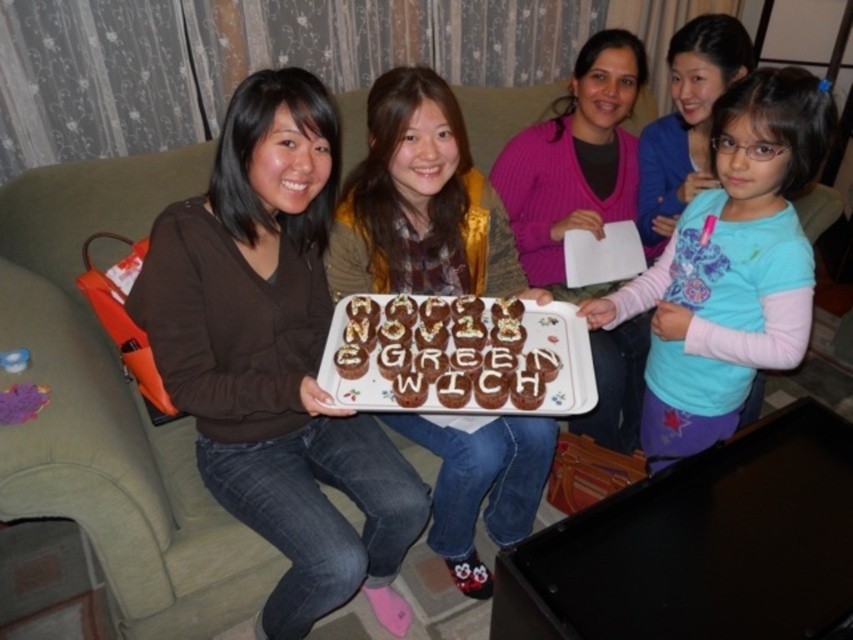
Question: Considering the relative positions of pink ribbed sweater at center and chocolatesmoothcake at center in the image provided, where is pink ribbed sweater at center located with respect to chocolatesmoothcake at center?

Choices:
 (A) above
 (B) below

Answer: (A)

Question: From the image, what is the correct spatial relationship of brown matte sweater at center in relation to blue cotton shirt at center?

Choices:
 (A) above
 (B) below

Answer: (B)

Question: Which object appears closest to the camera in this image?

Choices:
 (A) blue cotton shirt at center
 (B) pink ribbed sweater at center
 (C) matte brown sweater at center

Answer: (A)

Question: Among these objects, which one is nearest to the camera?

Choices:
 (A) pink ribbed sweater at center
 (B) blue cotton shirt at upper right
 (C) blue cotton shirt at center

Answer: (C)

Question: Is brown matte sweater at center above pink ribbed sweater at center?

Choices:
 (A) no
 (B) yes

Answer: (A)

Question: Among these points, which one is farthest from the camera?

Choices:
 (A) (445, 369)
 (B) (688, 372)

Answer: (B)